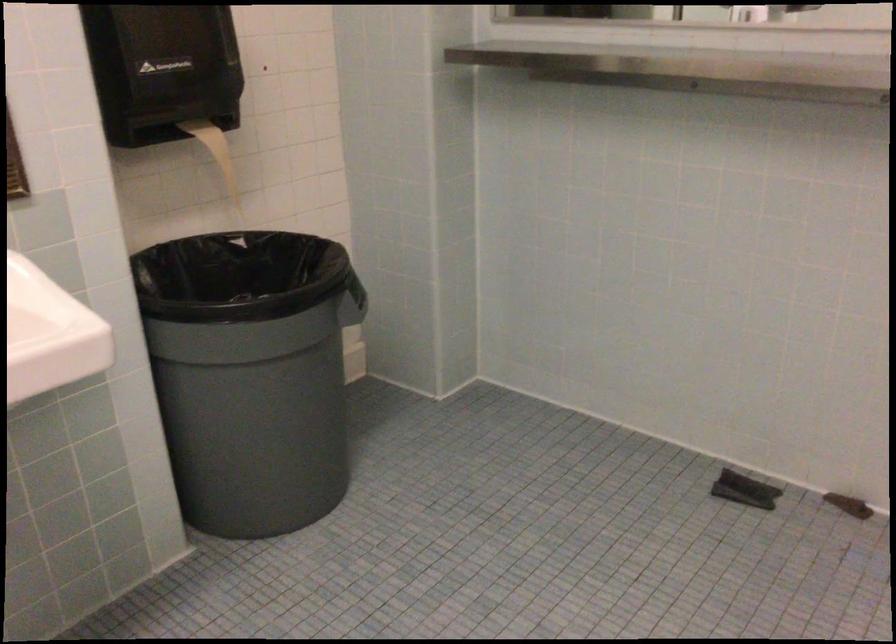
How did the camera likely rotate?

The rotation direction of the camera is left-down.